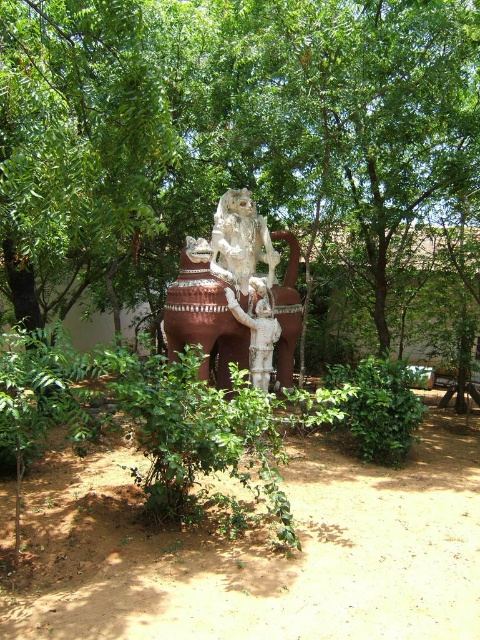
Question: Where is green leafy tree at center located in relation to white glossy statue at center in the image?

Choices:
 (A) below
 (B) above

Answer: (B)

Question: Is green leafy tree at center positioned before white glossy statue at center?

Choices:
 (A) no
 (B) yes

Answer: (A)

Question: Which object appears closest to the camera in this image?

Choices:
 (A) green leafy tree at center
 (B) white glossy statue at center

Answer: (B)

Question: Which point appears closest to the camera in this image?

Choices:
 (A) (228, 40)
 (B) (248, 326)

Answer: (B)

Question: Is green leafy tree at center below white glossy statue at center?

Choices:
 (A) yes
 (B) no

Answer: (B)